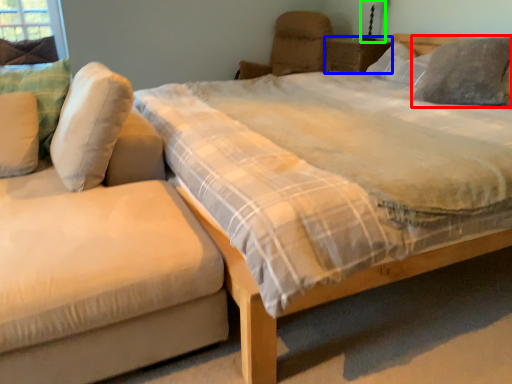
Question: Considering the real-world distances, which object is farthest from pillow (highlighted by a red box)? nightstand (highlighted by a blue box) or table lamp (highlighted by a green box)?

Choices:
 (A) nightstand
 (B) table lamp

Answer: (B)